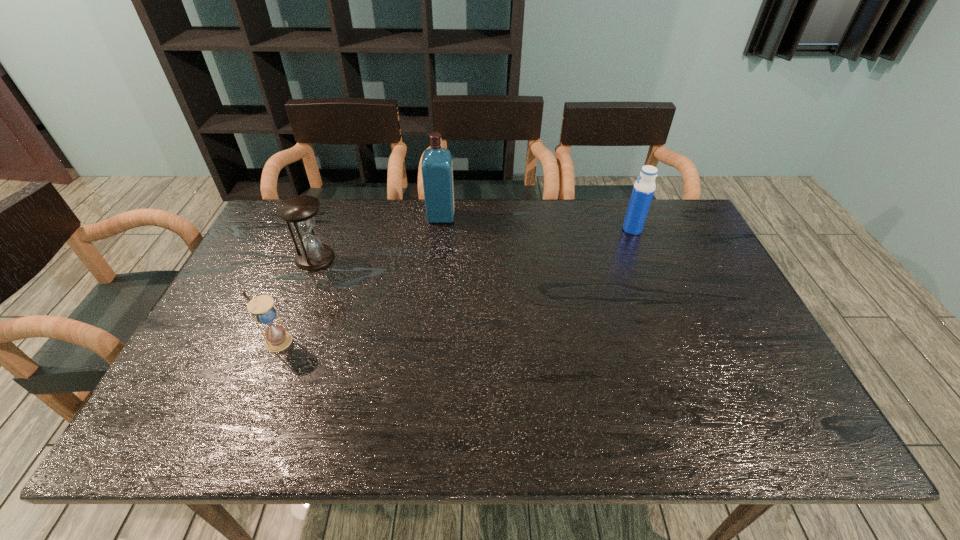
Identify the location of free space located 0.220m on the back of the taller hourglass. (337, 205).

You are a GUI agent. You are given a task and a screenshot of the screen. Output one action in this format:
    pyautogui.click(x=<x>, y=<y>)
    Task: Click on the free space located 0.060m on the right of the shortest object
    This screenshot has height=540, width=960.
    Given the screenshot: What is the action you would take?
    pyautogui.click(x=316, y=341)

Identify the location of liquor present at the far edge. This screenshot has width=960, height=540. (437, 165).

I want to click on water bottle present at the far edge, so click(643, 190).

This screenshot has width=960, height=540. In order to click on free space at the far edge in this screenshot , I will do `click(526, 237)`.

Where is `vacant space at the near edge of the desktop`? The image size is (960, 540). vacant space at the near edge of the desktop is located at coordinates (624, 422).

The width and height of the screenshot is (960, 540). Identify the location of vacant space at the left edge. (215, 386).

The image size is (960, 540). Find the location of `vacant space at the right edge`. vacant space at the right edge is located at coordinates (702, 274).

You are a GUI agent. You are given a task and a screenshot of the screen. Output one action in this format:
    pyautogui.click(x=<x>, y=<y>)
    Task: Click on the free space at the far right corner
    
    Given the screenshot: What is the action you would take?
    pyautogui.click(x=664, y=202)

The height and width of the screenshot is (540, 960). Find the location of `vacant position at the near right corner of the desktop`. vacant position at the near right corner of the desktop is located at coordinates (758, 436).